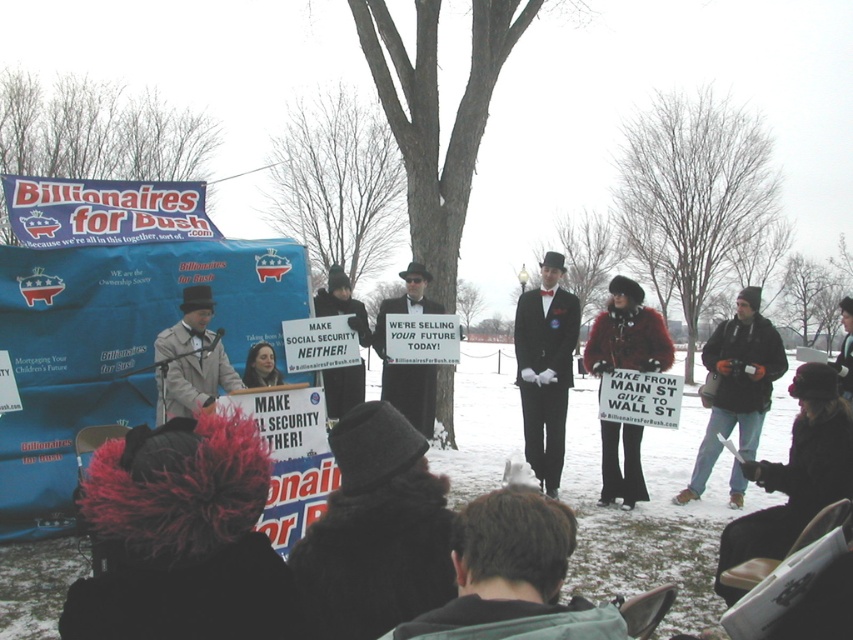
Consider the image. You are a photographer trying to capture a clear photo of both the shiny black suit at center and the matte gray coat at center. Since you want both subjects to be in focus, you need to adjust your camera settings based on their heights. Which subject should you focus on first to ensure both are sharp in the photo?

The shiny black suit at center is much taller than the matte gray coat at center. To ensure both are in focus, you should focus on the shiny black suit at center first, as it is the taller subject, and then adjust the depth of field accordingly.

You are a photographer trying to capture a clear photo of both the matte gray coat at center and the black suit coat at center. Since you want both coats to be in focus, which one should you adjust your camera focus to prioritize? Please explain your reasoning based on their positions.

You should prioritize focusing on the matte gray coat at center because it is closer to the viewer. In photography, focusing on the closer object ensures that both it and the farther object remain in acceptable focus due to the depth of field. By focusing on the closer matte gray coat at center, the black suit coat at center, which is farther away, will still be within the depth of field range, resulting in both being sharp.